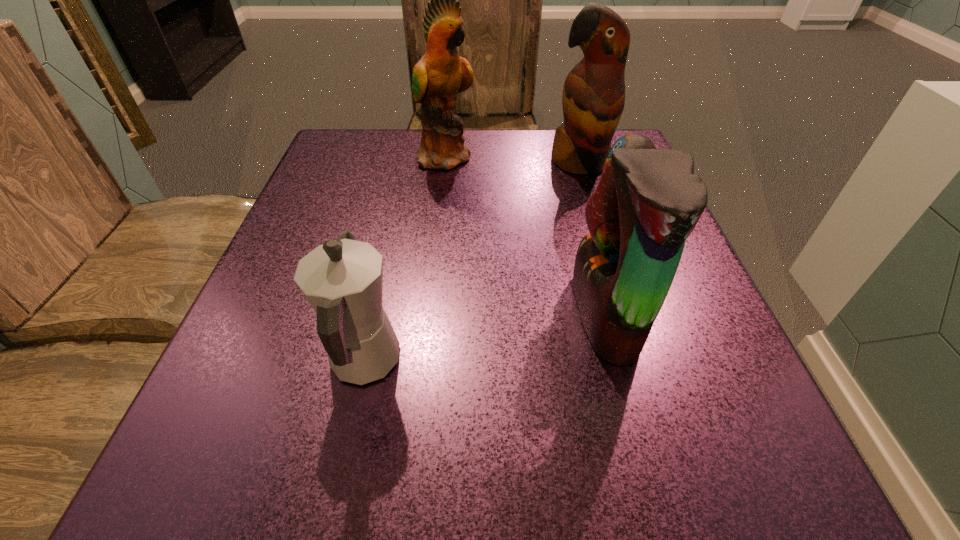
What are the coordinates of `the leftmost parrot` in the screenshot? It's located at (441, 74).

Locate an element on the screen. Image resolution: width=960 pixels, height=540 pixels. the shortest parrot is located at coordinates (648, 201).

The width and height of the screenshot is (960, 540). Identify the location of the third tallest object. (648, 201).

Identify the location of coffeepot. (342, 279).

Locate an element on the screen. The height and width of the screenshot is (540, 960). free space located 0.150m on the front-facing side of the leftmost parrot is located at coordinates (541, 157).

I want to click on free location located 0.370m at the face of the second shortest object, so click(x=329, y=313).

This screenshot has width=960, height=540. What are the coordinates of `vacant space located 0.140m at the face of the second shortest object` in the screenshot? It's located at (482, 313).

Locate an element on the screen. free space located at the face of the second shortest object is located at coordinates (369, 313).

The width and height of the screenshot is (960, 540). Identify the location of vacant position located 0.300m on the back of the shortest object. (400, 200).

Identify the location of object that is at the left edge. (342, 279).